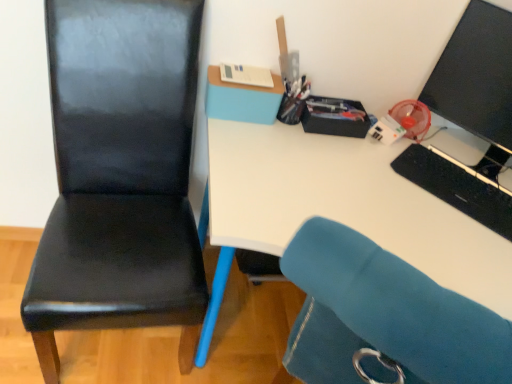
This screenshot has width=512, height=384. What are the coordinates of `free point in front of black matte keyboard at right` in the screenshot? It's located at (458, 245).